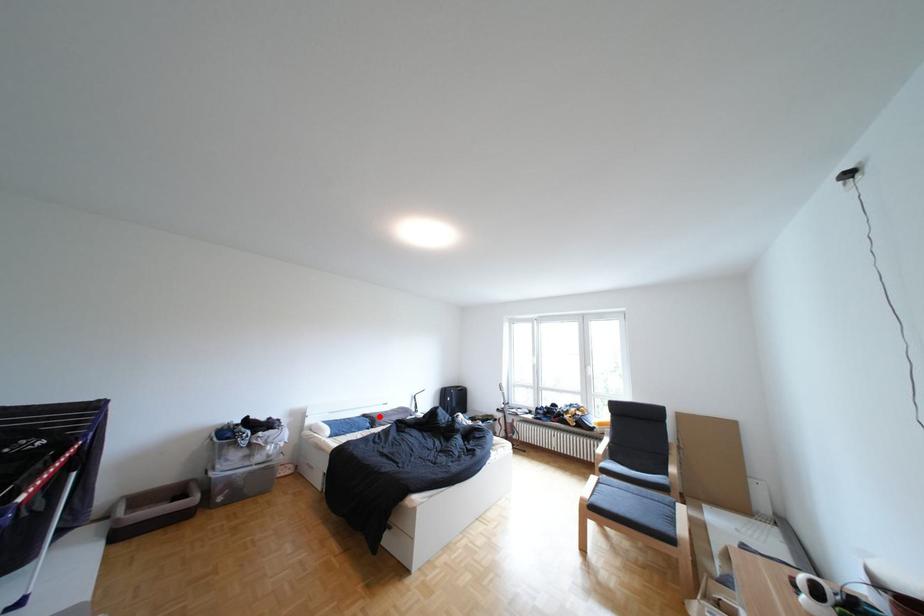
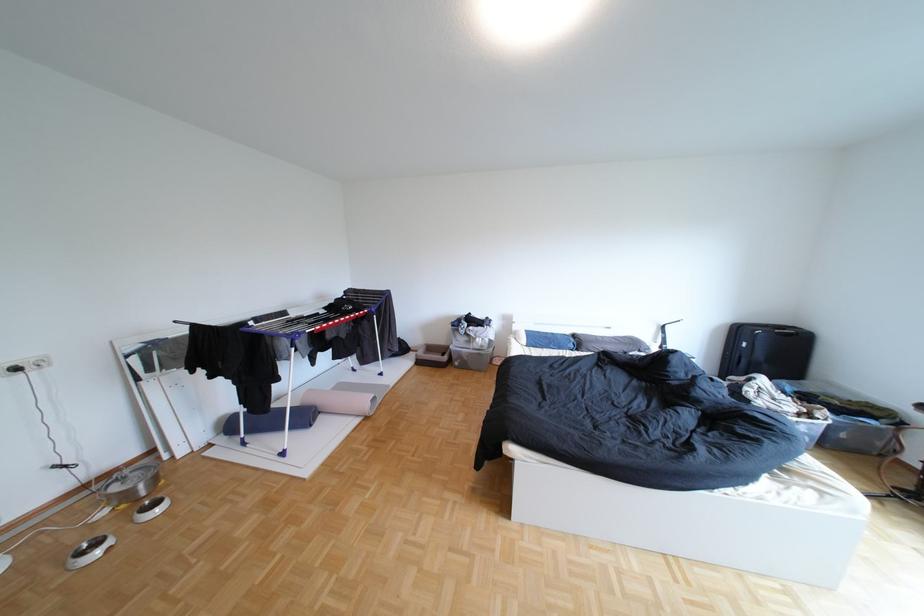
In the second image, find the point that corresponds to the highlighted location in the first image.

(590, 336)